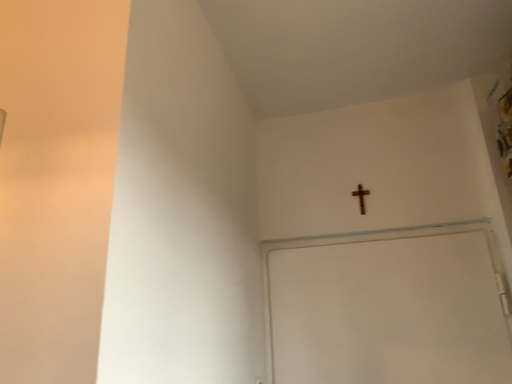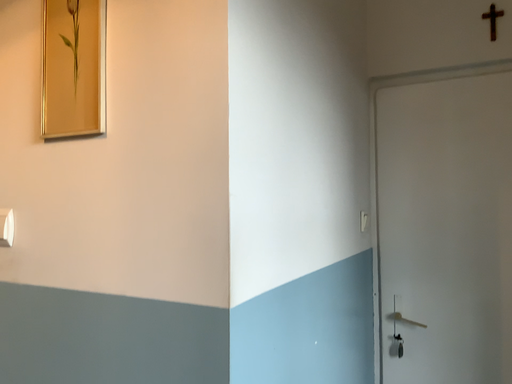
Question: How did the camera likely rotate when shooting the video?

Choices:
 (A) rotated downward
 (B) rotated upward

Answer: (A)